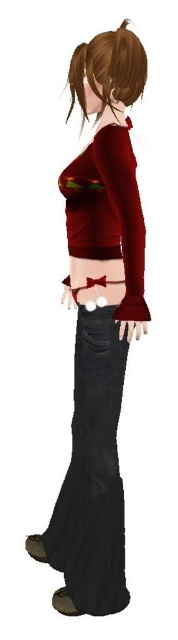
Question: Can you confirm if matte red blouse at center is positioned to the left of black matte pocket at lower center?

Choices:
 (A) no
 (B) yes

Answer: (A)

Question: Is denim jeans at center wider than matte red blouse at center?

Choices:
 (A) no
 (B) yes

Answer: (B)

Question: Among these objects, which one is farthest from the camera?

Choices:
 (A) matte red sweater at center
 (B) denim jeans at center
 (C) brown matte hair at upper center

Answer: (B)

Question: Among these objects, which one is farthest from the camera?

Choices:
 (A) denim jeans at center
 (B) black matte pocket at lower center
 (C) matte red blouse at center

Answer: (B)

Question: Does matte red sweater at center appear on the right side of denim jeans at center?

Choices:
 (A) yes
 (B) no

Answer: (A)

Question: Which of the following is the closest to the observer?

Choices:
 (A) (69, 570)
 (B) (101, 326)
 (C) (82, 433)
 (D) (122, 314)

Answer: (D)